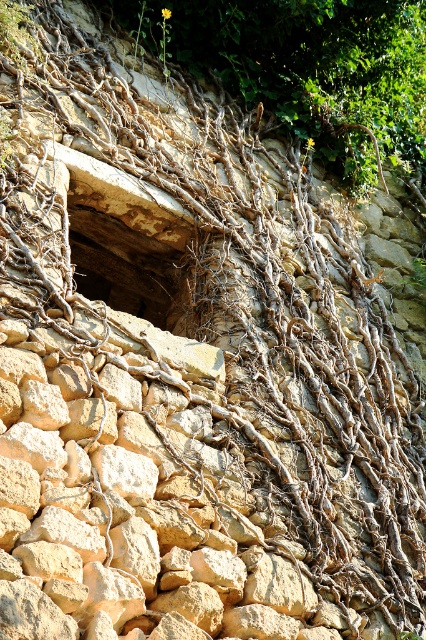
Question: Which point is closer to the camera taking this photo?

Choices:
 (A) (271, 13)
 (B) (154, 275)

Answer: (B)

Question: Which point is closer to the camera?

Choices:
 (A) (356, 140)
 (B) (88, 291)

Answer: (B)

Question: Is brown rough roots at center below brown rough stone hole at center?

Choices:
 (A) no
 (B) yes

Answer: (A)

Question: Which of the following is the closest to the observer?

Choices:
 (A) (149, 240)
 (B) (411, 156)

Answer: (A)

Question: Does brown rough roots at center have a smaller size compared to brown rough stone hole at center?

Choices:
 (A) no
 (B) yes

Answer: (B)

Question: Does brown rough roots at center have a lesser width compared to brown rough stone hole at center?

Choices:
 (A) yes
 (B) no

Answer: (A)